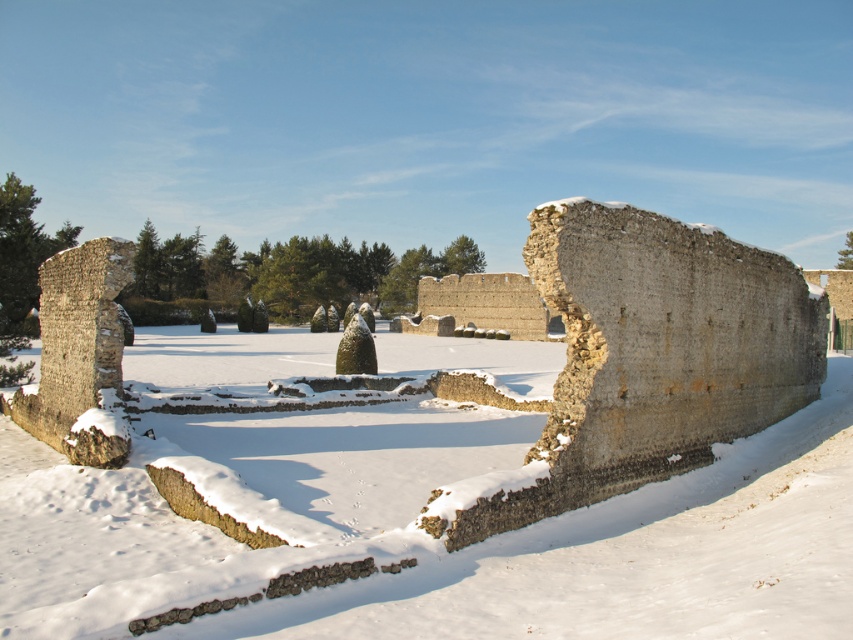
Question: Which object is farther from the camera taking this photo?

Choices:
 (A) rustic stone wall at center
 (B) white powdery snow at center

Answer: (A)

Question: Is white powdery snow at center positioned before rustic stone wall at center?

Choices:
 (A) yes
 (B) no

Answer: (A)

Question: Which object appears farthest from the camera in this image?

Choices:
 (A) white powdery snow at center
 (B) rustic stone wall at center

Answer: (B)

Question: Is white powdery snow at center positioned before rustic stone wall at center?

Choices:
 (A) no
 (B) yes

Answer: (B)

Question: Which point is farther to the camera?

Choices:
 (A) white powdery snow at center
 (B) rustic stone wall at center

Answer: (B)

Question: Can you confirm if white powdery snow at center is positioned to the left of rustic stone wall at center?

Choices:
 (A) no
 (B) yes

Answer: (B)